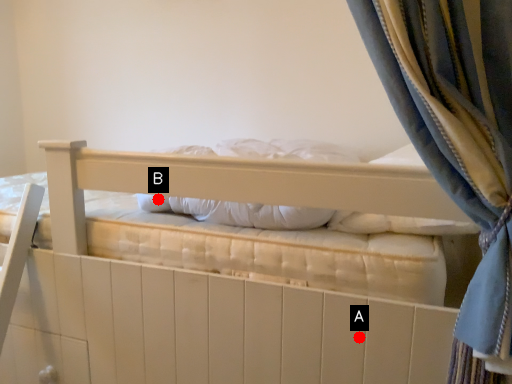
Question: Two points are circled on the image, labeled by A and B beside each circle. Which of the following is the closest to the observer?

Choices:
 (A) A is closer
 (B) B is closer

Answer: (A)